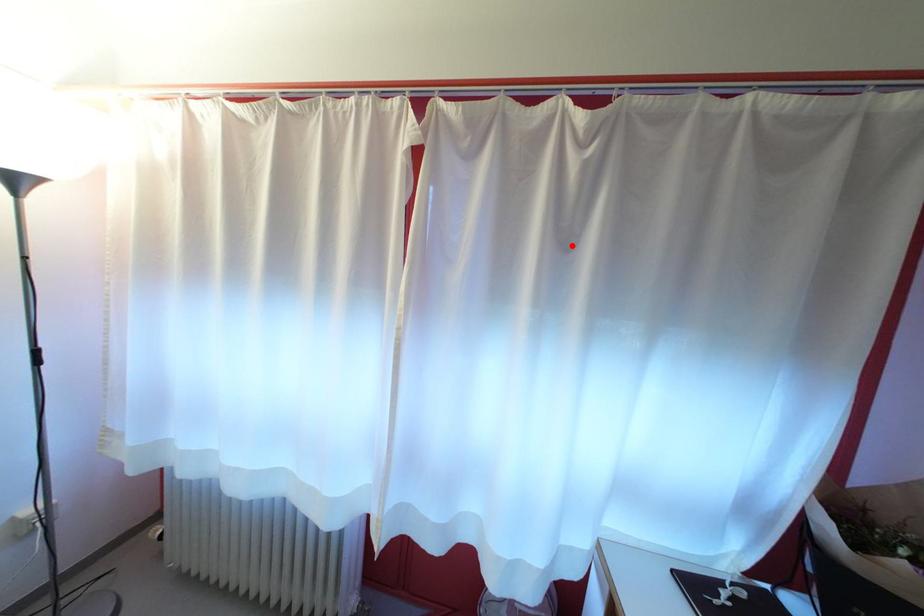
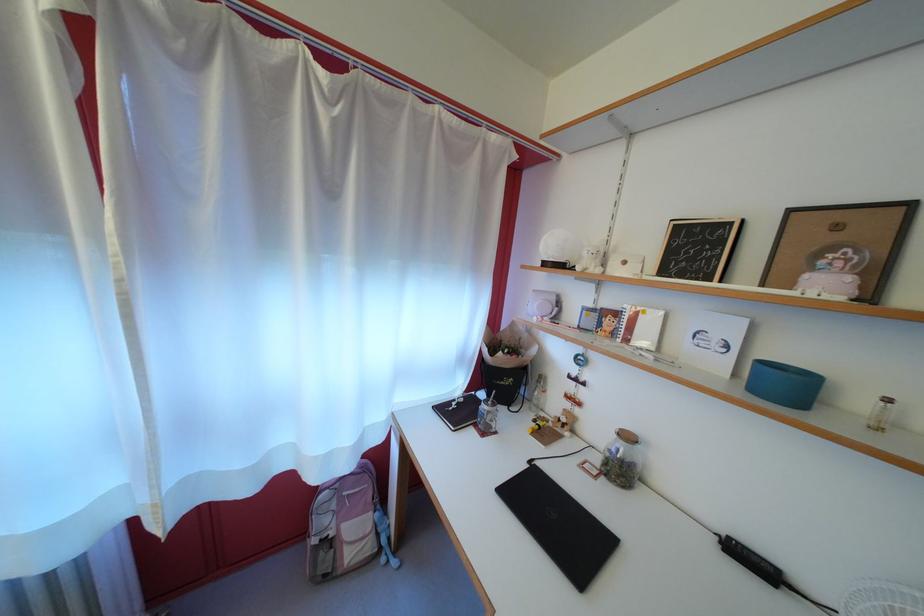
In the second image, find the point that corresponds to the highlighted location in the first image.

(335, 193)